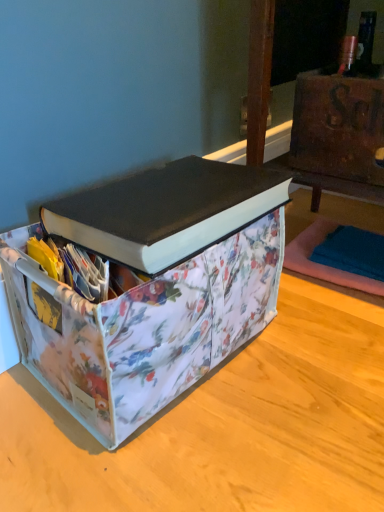
Question: Should I look upward or downward to see teal fabric yoga mat at lower right?

Choices:
 (A) down
 (B) up

Answer: (A)

Question: Considering the relative sizes of teal fabric yoga mat at lower right and floral fabric storage bin at lower right in the image provided, is teal fabric yoga mat at lower right wider than floral fabric storage bin at lower right?

Choices:
 (A) yes
 (B) no

Answer: (B)

Question: Is teal fabric yoga mat at lower right thinner than floral fabric storage bin at lower right?

Choices:
 (A) yes
 (B) no

Answer: (A)

Question: Is teal fabric yoga mat at lower right located outside floral fabric storage bin at lower right?

Choices:
 (A) no
 (B) yes

Answer: (B)

Question: Is teal fabric yoga mat at lower right positioned before floral fabric storage bin at lower right?

Choices:
 (A) no
 (B) yes

Answer: (A)

Question: Does teal fabric yoga mat at lower right turn towards floral fabric storage bin at lower right?

Choices:
 (A) yes
 (B) no

Answer: (B)

Question: Considering the relative sizes of teal fabric yoga mat at lower right and floral fabric storage bin at lower right in the image provided, is teal fabric yoga mat at lower right shorter than floral fabric storage bin at lower right?

Choices:
 (A) no
 (B) yes

Answer: (B)

Question: Are floral fabric storage bin at lower right and floral fabric storage bin at center located far from each other?

Choices:
 (A) no
 (B) yes

Answer: (A)

Question: Considering the relative sizes of floral fabric storage bin at lower right and floral fabric storage bin at center in the image provided, is floral fabric storage bin at lower right shorter than floral fabric storage bin at center?

Choices:
 (A) no
 (B) yes

Answer: (A)

Question: Could floral fabric storage bin at center be considered to be inside floral fabric storage bin at lower right?

Choices:
 (A) yes
 (B) no

Answer: (B)

Question: Is floral fabric storage bin at lower right behind floral fabric storage bin at center?

Choices:
 (A) no
 (B) yes

Answer: (B)

Question: Considering the relative sizes of floral fabric storage bin at lower right and floral fabric storage bin at center in the image provided, is floral fabric storage bin at lower right smaller than floral fabric storage bin at center?

Choices:
 (A) yes
 (B) no

Answer: (B)

Question: Is floral fabric storage bin at lower right bigger than floral fabric storage bin at center?

Choices:
 (A) yes
 (B) no

Answer: (A)

Question: From a real-world perspective, is black matte book at upper center physically above floral fabric storage bin at lower right?

Choices:
 (A) yes
 (B) no

Answer: (B)